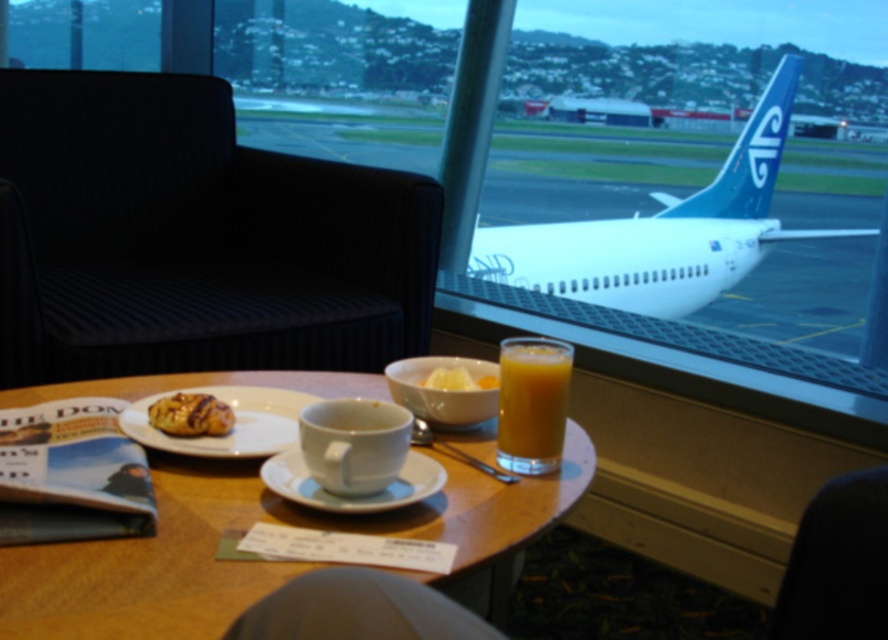
Can you confirm if white glossy airplane at upper right is positioned below translucent glass juice at center?

No, white glossy airplane at upper right is not below translucent glass juice at center.

Is white glossy airplane at upper right shorter than translucent glass juice at center?

Incorrect, white glossy airplane at upper right's height does not fall short of translucent glass juice at center's.

Does point (707, 284) come in front of point (533, 337)?

No, it is not.

Image resolution: width=888 pixels, height=640 pixels. Find the location of `white glossy airplane at upper right`. white glossy airplane at upper right is located at coordinates (663, 230).

Can you confirm if golden glazed pastry at center is smaller than yellow creamy spread at center?

No, golden glazed pastry at center is not smaller than yellow creamy spread at center.

Is golden glazed pastry at center closer to the viewer compared to yellow creamy spread at center?

Yes, golden glazed pastry at center is closer to the viewer.

Is point (147, 412) positioned after point (464, 384)?

No, (147, 412) is closer to viewer.

This screenshot has width=888, height=640. What are the coordinates of `golden glazed pastry at center` in the screenshot? It's located at (191, 416).

The height and width of the screenshot is (640, 888). Describe the element at coordinates (193, 237) in the screenshot. I see `black fabric armchair at left` at that location.

Locate an element on the screen. black fabric armchair at left is located at coordinates (193, 237).